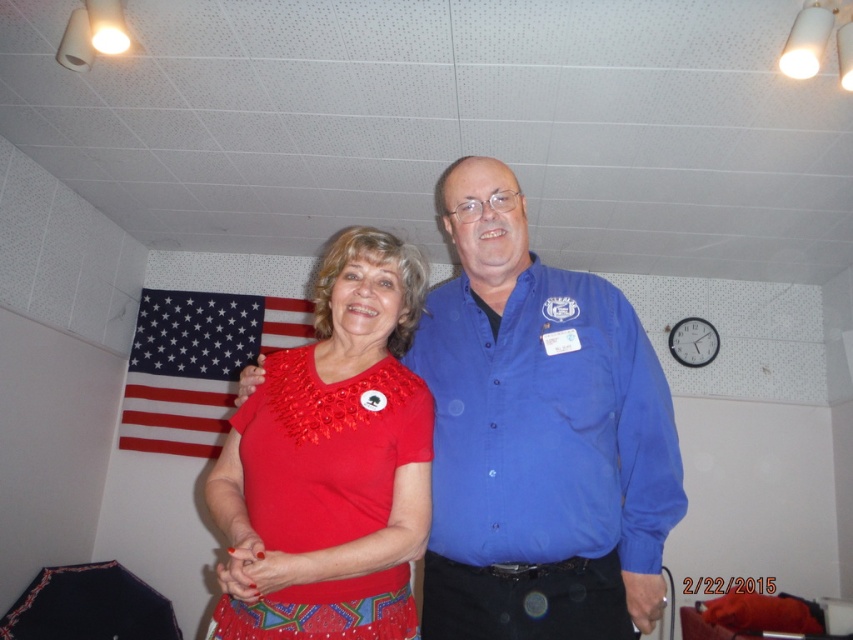
Question: Does blue button-down shirt at center have a larger size compared to blue button-up shirt at center?

Choices:
 (A) no
 (B) yes

Answer: (B)

Question: Which point is farther to the camera?

Choices:
 (A) (480, 362)
 (B) (144, 296)

Answer: (B)

Question: Which point is farther to the camera?

Choices:
 (A) 398,404
 (B) 450,428
 (C) 444,410

Answer: (C)

Question: Can you confirm if matte red blouse at center is wider than blue button-up shirt at center?

Choices:
 (A) yes
 (B) no

Answer: (B)

Question: Among these points, which one is nearest to the camera?

Choices:
 (A) (669, 497)
 (B) (595, 396)

Answer: (B)

Question: Can you confirm if matte red blouse at center is wider than blue button-up shirt at center?

Choices:
 (A) yes
 (B) no

Answer: (B)